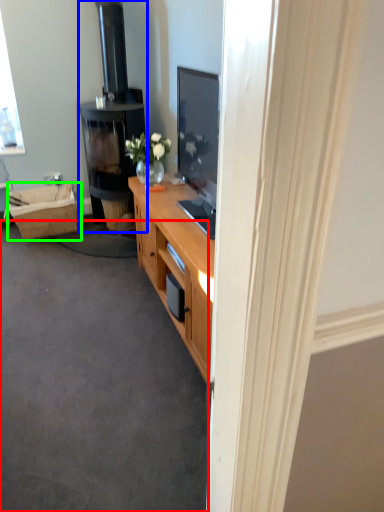
Question: Which object is the farthest from plain (highlighted by a red box)? Choose among these: fireplace (highlighted by a blue box) or picnic basket (highlighted by a green box).

Choices:
 (A) fireplace
 (B) picnic basket

Answer: (A)